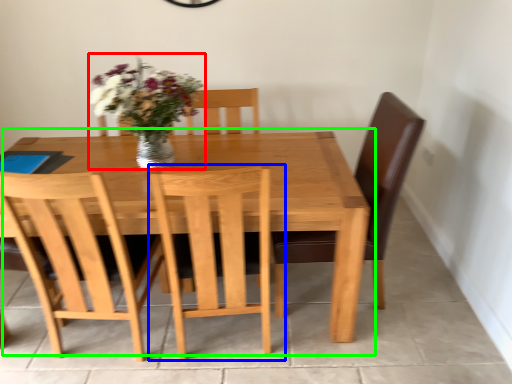
Question: Which object is the closest to the floral arrangement (highlighted by a red box)? Choose among these: chair (highlighted by a blue box) or kitchen & dining room table (highlighted by a green box).

Choices:
 (A) chair
 (B) kitchen & dining room table

Answer: (B)